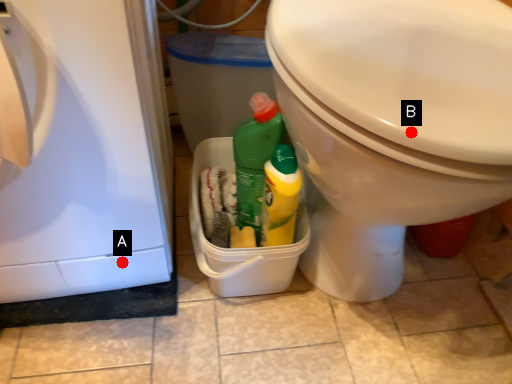
Question: Two points are circled on the image, labeled by A and B beside each circle. Which point is farther from the camera taking this photo?

Choices:
 (A) A is further
 (B) B is further

Answer: (A)